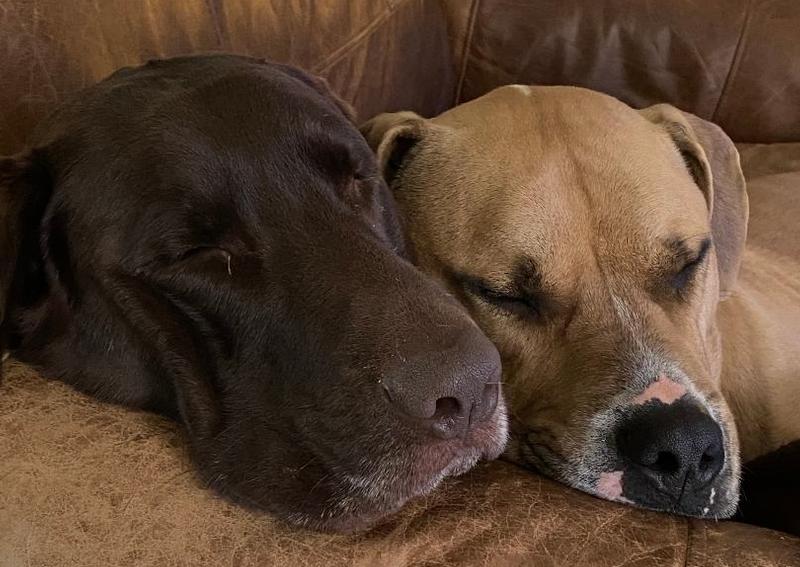
The width and height of the screenshot is (800, 567). In order to click on white fur in this screenshot , I will do pyautogui.click(x=380, y=480).